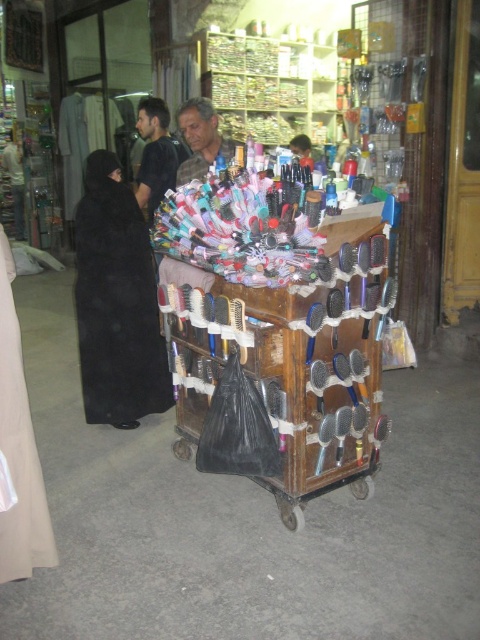
Find the location of a particular element. black matte abaya at left is located at coordinates (117, 301).

I want to click on black matte abaya at left, so click(x=117, y=301).

This screenshot has width=480, height=640. Identify the location of black matte abaya at left. (117, 301).

Is wooden trolley at center behind black matte abaya at left?

No, wooden trolley at center is closer to the viewer.

Between wooden trolley at center and black matte abaya at left, which one has more height?

black matte abaya at left

I want to click on wooden trolley at center, so click(276, 332).

This screenshot has height=640, width=480. Find the location of `wooden trolley at center`. wooden trolley at center is located at coordinates (276, 332).

Is dark brown hair at center to the left of camouflage fabric shirt at center from the viewer's perspective?

Correct, you'll find dark brown hair at center to the left of camouflage fabric shirt at center.

Is dark brown hair at center above camouflage fabric shirt at center?

Yes, dark brown hair at center is above camouflage fabric shirt at center.

You are a GUI agent. You are given a task and a screenshot of the screen. Output one action in this format:
    pyautogui.click(x=<x>, y=<y>)
    Task: Click on the dark brown hair at center
    The height and width of the screenshot is (640, 480).
    Given the screenshot: What is the action you would take?
    pyautogui.click(x=156, y=154)